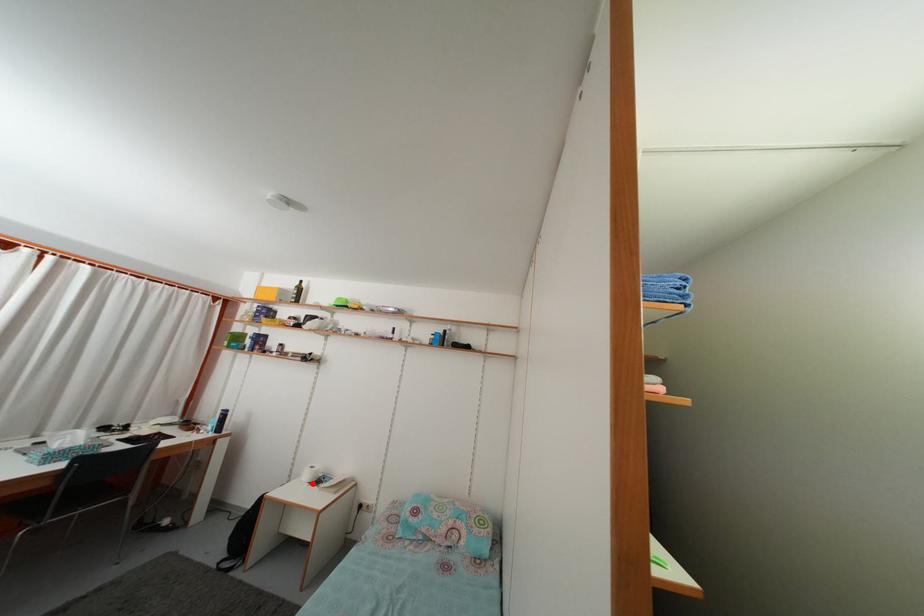
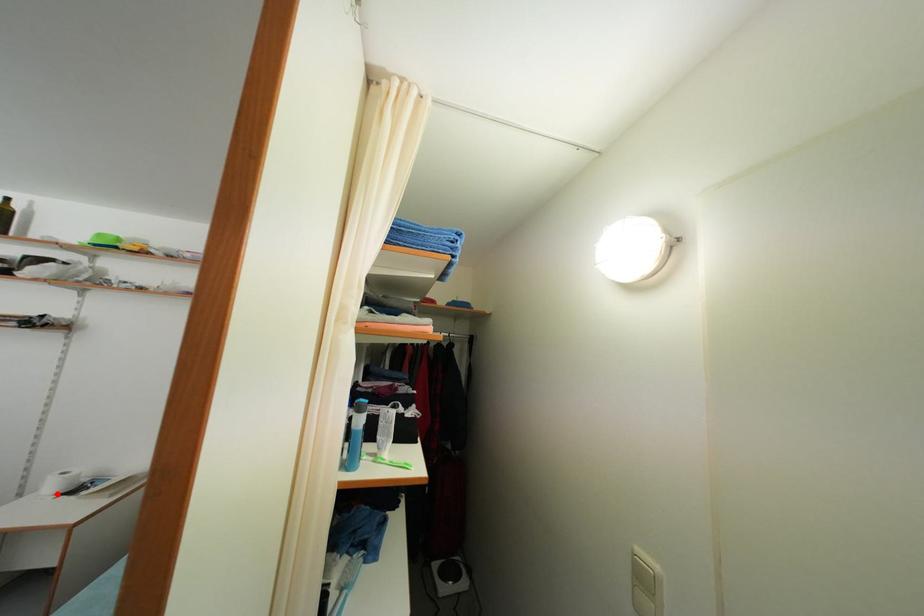
I am providing you with two images of the same scene from different viewpoints. A red point is marked on the first image and another point is marked on the second image. Does the point marked in image1 correspond to the same location as the one in image2?

Yes